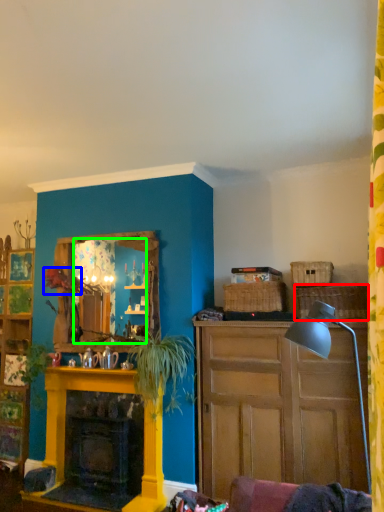
Question: Based on their relative distances, which object is farther from picnic basket (highlighted by a red box)? Choose from flower (highlighted by a blue box) and mirror (highlighted by a green box).

Choices:
 (A) flower
 (B) mirror

Answer: (A)